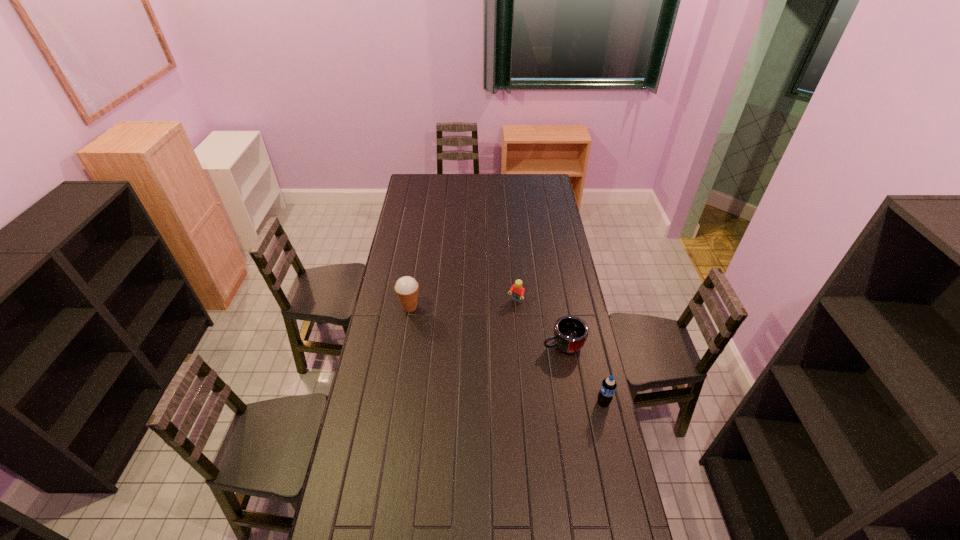
Where is `vacant space in between the second object from left to right and the icecream`? This screenshot has height=540, width=960. vacant space in between the second object from left to right and the icecream is located at coordinates (463, 305).

Identify the location of free spot between the Lego and the mug. [540, 323].

Locate an element on the screen. The image size is (960, 540). free space between the third object from right to left and the soda bottle is located at coordinates (560, 352).

This screenshot has width=960, height=540. In order to click on free space that is in between the mug and the nearest object in this screenshot , I will do coord(584,374).

The width and height of the screenshot is (960, 540). Find the location of `vacant area between the mug and the Lego`. vacant area between the mug and the Lego is located at coordinates (540, 323).

The width and height of the screenshot is (960, 540). What are the coordinates of `free area in between the icecream and the third farthest object` in the screenshot? It's located at (487, 326).

Locate an element on the screen. The width and height of the screenshot is (960, 540). unoccupied area between the second object from left to right and the second nearest object is located at coordinates (540, 323).

The height and width of the screenshot is (540, 960). Find the location of `vacant point located between the nearest object and the third object from right to left`. vacant point located between the nearest object and the third object from right to left is located at coordinates (560, 352).

What are the coordinates of `vacant region between the Lego and the icecream` in the screenshot? It's located at (463, 305).

At what (x,y) coordinates should I click in order to perform the action: click on object identified as the third closest to the Lego. Please return your answer as a coordinate pair (x, y). Looking at the image, I should click on (608, 386).